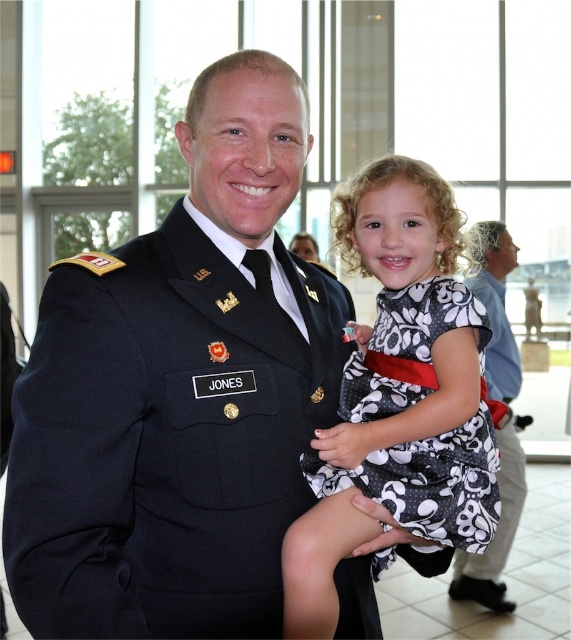
You are a photographer trying to capture a candid shot of the man and the girl. You notice two points in the image at coordinates point (464, 529) and point (488, 342). Which point should you focus on to ensure the subject in front is in sharp focus?

Point (464, 529) is in front of point (488, 342), so focusing on point (464, 529) will ensure the subject in front is in sharp focus.

You are a photographer adjusting your camera to focus on two specific points in the image. The first point is point (x=162, y=332) and the second is point (x=506, y=429). Which point should you focus on first if you want to capture the closest object in the scene?

Point (x=162, y=332) is closer to the viewer than point (x=506, y=429), so you should focus on point (x=162, y=332) first to capture the closest object in the scene.

You are a photographer at an event and need to ensure that both the dark blue uniform at center and the black dotted fabric dress at center are visible in the photo. Based on their positions, which one is covering part of the other?

The dark blue uniform at center is positioned over the black dotted fabric dress at center, meaning it is covering part of the dress.